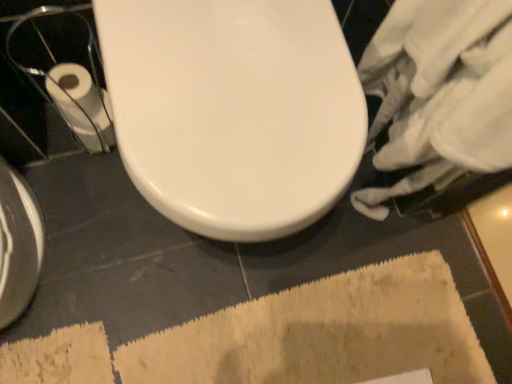
Question: Should I look upward or downward to see beige textured bath mat at lower center?

Choices:
 (A) up
 (B) down

Answer: (B)

Question: Is white paper at left facing towards beige textured bath mat at lower center?

Choices:
 (A) yes
 (B) no

Answer: (B)

Question: From the image's perspective, is white paper at left over beige textured bath mat at lower center?

Choices:
 (A) no
 (B) yes

Answer: (B)

Question: Considering the relative positions of white paper at left and beige textured bath mat at lower center in the image provided, is white paper at left to the right of beige textured bath mat at lower center from the viewer's perspective?

Choices:
 (A) yes
 (B) no

Answer: (B)

Question: From the image's perspective, is white paper at left located beneath beige textured bath mat at lower center?

Choices:
 (A) yes
 (B) no

Answer: (B)

Question: Considering the relative sizes of white paper at left and beige textured bath mat at lower center in the image provided, is white paper at left smaller than beige textured bath mat at lower center?

Choices:
 (A) yes
 (B) no

Answer: (A)

Question: From a real-world perspective, is white paper at left below beige textured bath mat at lower center?

Choices:
 (A) no
 (B) yes

Answer: (A)

Question: Is beige textured bath mat at lower center looking in the opposite direction of white glossy toilet at center?

Choices:
 (A) no
 (B) yes

Answer: (A)

Question: Could you tell me if beige textured bath mat at lower center is turned towards white glossy toilet at center?

Choices:
 (A) yes
 (B) no

Answer: (B)

Question: Is beige textured bath mat at lower center closer to camera compared to white glossy toilet at center?

Choices:
 (A) no
 (B) yes

Answer: (A)

Question: From a real-world perspective, is beige textured bath mat at lower center located higher than white glossy toilet at center?

Choices:
 (A) yes
 (B) no

Answer: (B)

Question: From the image's perspective, does beige textured bath mat at lower center appear higher than white glossy toilet at center?

Choices:
 (A) yes
 (B) no

Answer: (B)

Question: Is beige textured bath mat at lower center shorter than white glossy toilet at center?

Choices:
 (A) no
 (B) yes

Answer: (B)

Question: Considering the relative sizes of white glossy toilet at center and beige textured bath mat at lower center in the image provided, is white glossy toilet at center shorter than beige textured bath mat at lower center?

Choices:
 (A) no
 (B) yes

Answer: (A)